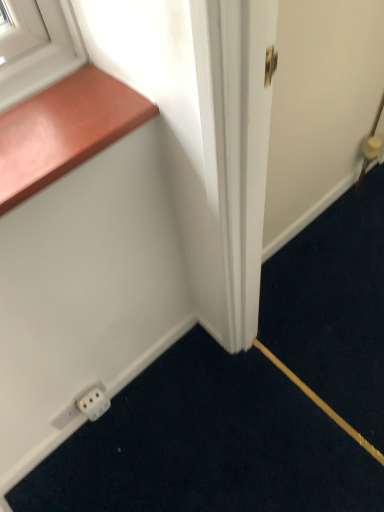
Question: From a real-world perspective, is white plastic outlet at lower left, the second electric outlet positioned from the left, below white plastic electric outlet at lower left, acting as the first electric outlet starting from the left?

Choices:
 (A) no
 (B) yes

Answer: (A)

Question: Is white plastic outlet at lower left, the first electric outlet when ordered from right to left, positioned beyond the bounds of white plastic electric outlet at lower left, acting as the first electric outlet starting from the left?

Choices:
 (A) yes
 (B) no

Answer: (A)

Question: Is white plastic outlet at lower left, the second electric outlet positioned from the left, far from white plastic electric outlet at lower left, the second electric outlet when ordered from right to left?

Choices:
 (A) no
 (B) yes

Answer: (A)

Question: Is the surface of white plastic outlet at lower left, the second electric outlet positioned from the left, in direct contact with white plastic electric outlet at lower left, acting as the first electric outlet starting from the left?

Choices:
 (A) no
 (B) yes

Answer: (B)

Question: Considering the relative sizes of white plastic outlet at lower left, the first electric outlet when ordered from right to left, and white plastic electric outlet at lower left, acting as the first electric outlet starting from the left, in the image provided, is white plastic outlet at lower left, the first electric outlet when ordered from right to left, bigger than white plastic electric outlet at lower left, acting as the first electric outlet starting from the left,?

Choices:
 (A) no
 (B) yes

Answer: (B)

Question: Considering the positions of white plastic electric outlet at lower left, the second electric outlet when ordered from right to left, and wooden at upper left in the image, is white plastic electric outlet at lower left, the second electric outlet when ordered from right to left, wider or thinner than wooden at upper left?

Choices:
 (A) wide
 (B) thin

Answer: (B)

Question: In terms of size, does white plastic electric outlet at lower left, the second electric outlet when ordered from right to left, appear bigger or smaller than wooden at upper left?

Choices:
 (A) small
 (B) big

Answer: (A)

Question: Is white plastic electric outlet at lower left, the second electric outlet when ordered from right to left, inside the boundaries of wooden at upper left, or outside?

Choices:
 (A) inside
 (B) outside

Answer: (B)

Question: Considering the positions of point (86, 397) and point (77, 144), is point (86, 397) closer or farther from the camera than point (77, 144)?

Choices:
 (A) farther
 (B) closer

Answer: (A)

Question: Is wooden at upper left to the left or to the right of white plastic electric outlet at lower left, acting as the first electric outlet starting from the left, in the image?

Choices:
 (A) left
 (B) right

Answer: (B)

Question: From their relative heights in the image, would you say wooden at upper left is taller or shorter than white plastic electric outlet at lower left, acting as the first electric outlet starting from the left?

Choices:
 (A) short
 (B) tall

Answer: (A)

Question: Considering their positions, is wooden at upper left located in front of or behind white plastic electric outlet at lower left, acting as the first electric outlet starting from the left?

Choices:
 (A) front
 (B) behind

Answer: (A)

Question: In terms of size, does wooden at upper left appear bigger or smaller than white plastic electric outlet at lower left, the second electric outlet when ordered from right to left?

Choices:
 (A) small
 (B) big

Answer: (B)

Question: From the image's perspective, is white plastic electric outlet at lower left, acting as the first electric outlet starting from the left, positioned above or below white plastic outlet at lower left, the second electric outlet positioned from the left?

Choices:
 (A) below
 (B) above

Answer: (A)

Question: From a real-world perspective, is white plastic electric outlet at lower left, the second electric outlet when ordered from right to left, above or below white plastic outlet at lower left, the second electric outlet positioned from the left?

Choices:
 (A) above
 (B) below

Answer: (B)